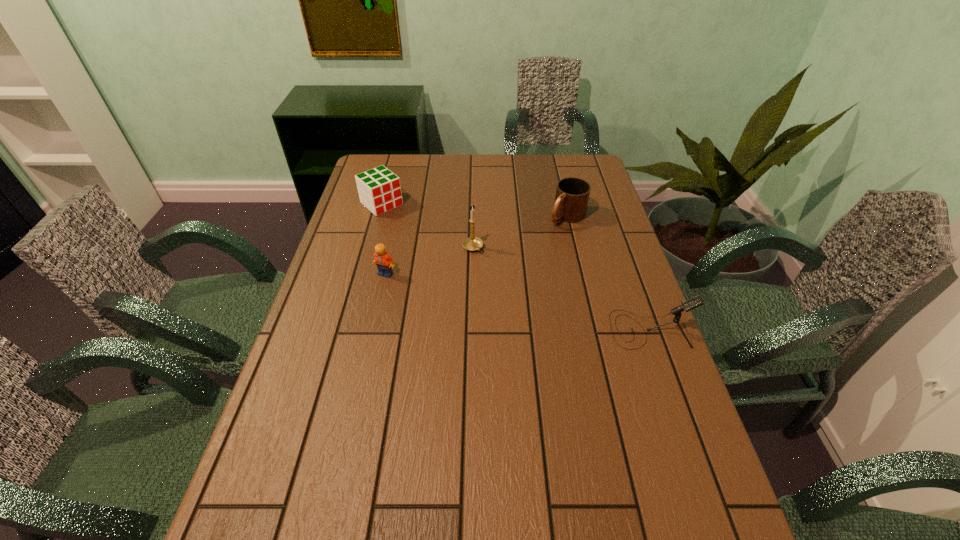
The width and height of the screenshot is (960, 540). What are the coordinates of `Lego` in the screenshot? It's located at (384, 262).

The width and height of the screenshot is (960, 540). Find the location of `the nearest object`. the nearest object is located at coordinates (690, 304).

The image size is (960, 540). I want to click on cube, so click(379, 189).

This screenshot has height=540, width=960. In order to click on the third nearest object in this screenshot , I will do `click(472, 243)`.

At what (x,y) coordinates should I click in order to perform the action: click on candle holder. Please return your answer as a coordinate pair (x, y). The height and width of the screenshot is (540, 960). Looking at the image, I should click on (472, 243).

Where is `mug`? The height and width of the screenshot is (540, 960). mug is located at coordinates (572, 194).

Locate an element on the screen. The height and width of the screenshot is (540, 960). free space located 0.330m on the front-facing side of the fourth farthest object is located at coordinates (363, 374).

What are the coordinates of `free spot located 0.100m on the stand of the microphone` in the screenshot? It's located at (573, 329).

Locate an element on the screen. This screenshot has height=540, width=960. free spot located 0.340m on the stand of the microphone is located at coordinates (481, 329).

Where is `vacant region located 0.240m on the stand of the microphone`? The image size is (960, 540). vacant region located 0.240m on the stand of the microphone is located at coordinates (519, 329).